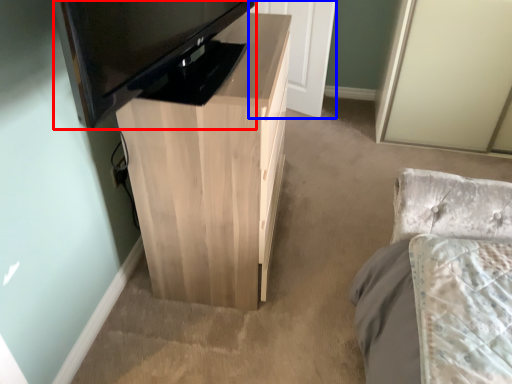
Question: Which object appears closest to the camera in this image, television (highlighted by a red box) or door (highlighted by a blue box)?

Choices:
 (A) television
 (B) door

Answer: (A)